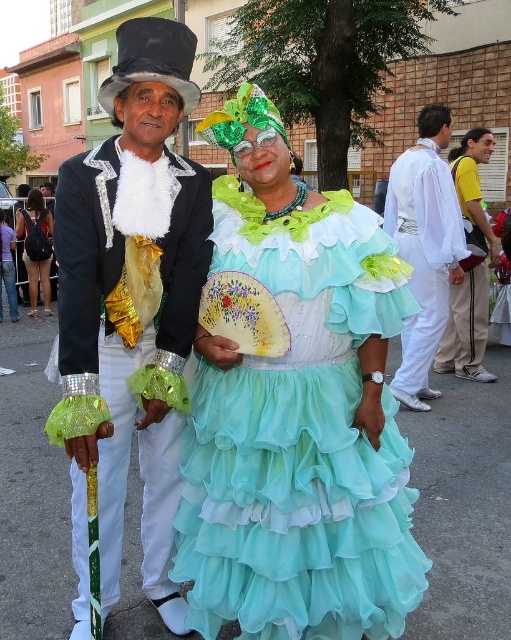
You are a photographer trying to capture a clear photo of the turquoise chiffon dress at center and the matte black backpack at left. Which object should you focus on first to ensure it appears sharp in the foreground?

The turquoise chiffon dress at center is in front of the matte black backpack at left, so you should focus on the turquoise chiffon dress at center first to ensure it appears sharp in the foreground.

You are a photographer trying to capture the shiny black fabric top hat at upper left. The camera you are using has a focal length of 50mm and an aperture of f2.8. The hat is located at point coordinates (130, 307) in the image. If the person wearing the hat moves 0.1 units closer to the camera along the y axis, will the hat still be within the frame?

The point coordinates (130, 307) for the shiny black fabric top hat at upper left are within the image frame. Moving 0.1 units closer along the y axis would adjust its position, but since the original coordinates are already valid, the hat should remain in frame unless the movement exceeds the boundaries. However, without knowing the exact frame boundaries or the direction of the movement, it is impossible to definitively confirm if it stays within the frame.